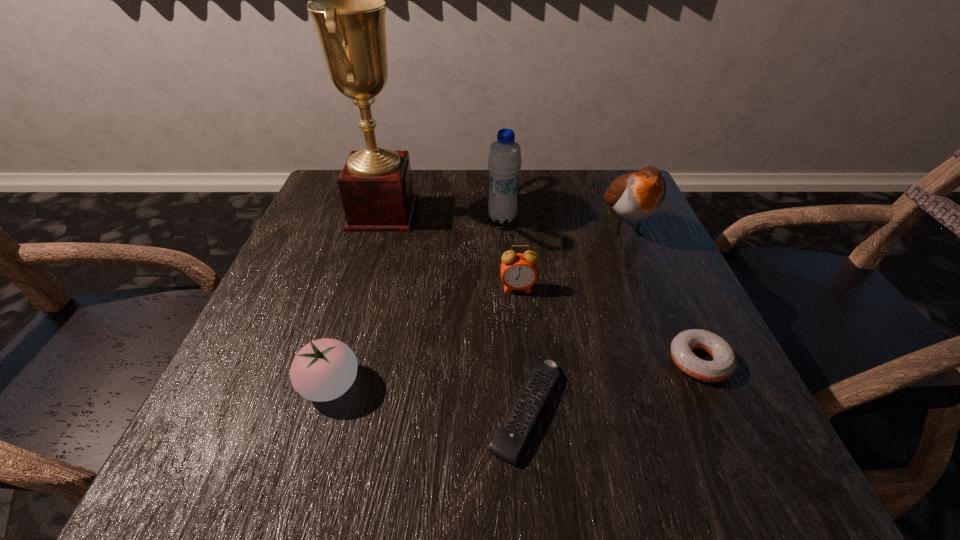
Identify the location of free spot located on the face of the alarm clock. The image size is (960, 540). (535, 469).

Locate an element on the screen. vacant space situated 0.120m on the back of the tomato is located at coordinates (353, 307).

Locate an element on the screen. vacant space situated 0.330m on the left of the second shortest object is located at coordinates (464, 361).

Image resolution: width=960 pixels, height=540 pixels. I want to click on vacant position located 0.250m on the back of the shortest object, so click(514, 263).

Identify the location of trophy cup situated at the far edge. This screenshot has width=960, height=540. tap(375, 184).

At what (x,y) coordinates should I click in order to perform the action: click on water bottle that is at the far edge. Please return your answer as a coordinate pair (x, y). Looking at the image, I should click on (504, 162).

At what (x,y) coordinates should I click in order to perform the action: click on bird at the far edge. Please return your answer as a coordinate pair (x, y). The image size is (960, 540). Looking at the image, I should click on (636, 196).

Locate an element on the screen. This screenshot has width=960, height=540. object that is at the near edge is located at coordinates (514, 431).

Identify the location of trophy cup located at the left edge. The image size is (960, 540). (375, 184).

You are a GUI agent. You are given a task and a screenshot of the screen. Output one action in this format:
    pyautogui.click(x=<x>, y=<y>)
    Task: Click on the tomato that is at the left edge
    
    Given the screenshot: What is the action you would take?
    coord(324,369)